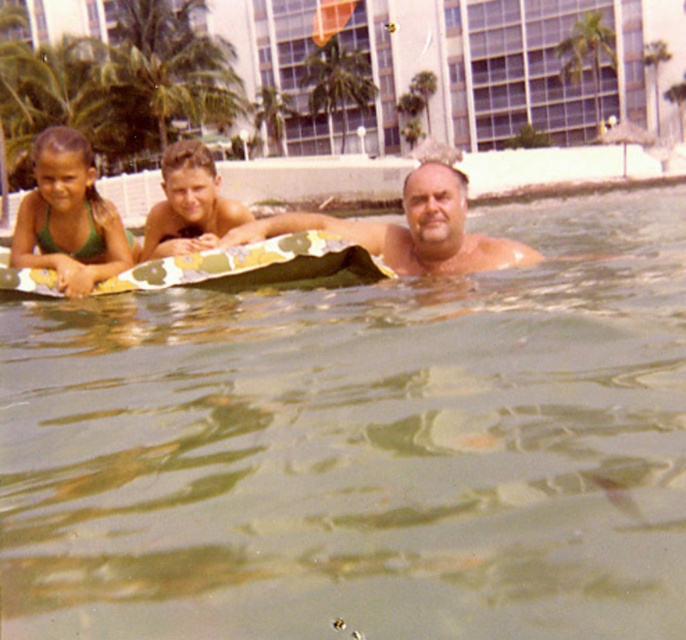
Can you confirm if green fabric swimsuit at upper left is bigger than green leafy palm tree at upper right?

Actually, green fabric swimsuit at upper left might be smaller than green leafy palm tree at upper right.

Does green fabric swimsuit at upper left appear under green leafy palm tree at upper right?

Yes, green fabric swimsuit at upper left is below green leafy palm tree at upper right.

Locate an element on the screen. The height and width of the screenshot is (640, 686). green fabric swimsuit at upper left is located at coordinates (69, 218).

The width and height of the screenshot is (686, 640). I want to click on green fabric swimsuit at upper left, so click(x=69, y=218).

Image resolution: width=686 pixels, height=640 pixels. Describe the element at coordinates (265, 240) in the screenshot. I see `green fabric float at upper left` at that location.

This screenshot has height=640, width=686. What are the coordinates of `green fabric float at upper left` in the screenshot? It's located at (265, 240).

Who is positioned more to the right, smooth tan skin at center or green fabric swimsuit at upper left?

smooth tan skin at center

Is smooth tan skin at center to the left of green fabric swimsuit at upper left from the viewer's perspective?

Incorrect, smooth tan skin at center is not on the left side of green fabric swimsuit at upper left.

Who is more forward, (x=239, y=241) or (x=58, y=266)?

Positioned in front is point (x=239, y=241).

The image size is (686, 640). Identify the location of smooth tan skin at center. (407, 228).